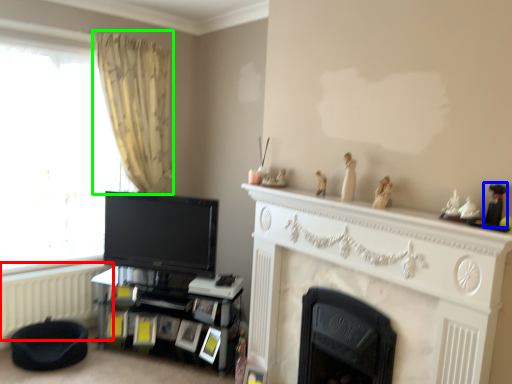
Question: Estimate the real-world distances between objects in this image. Which object is farther from radiator (highlighted by a red box), toy (highlighted by a blue box) or curtain (highlighted by a green box)?

Choices:
 (A) toy
 (B) curtain

Answer: (A)